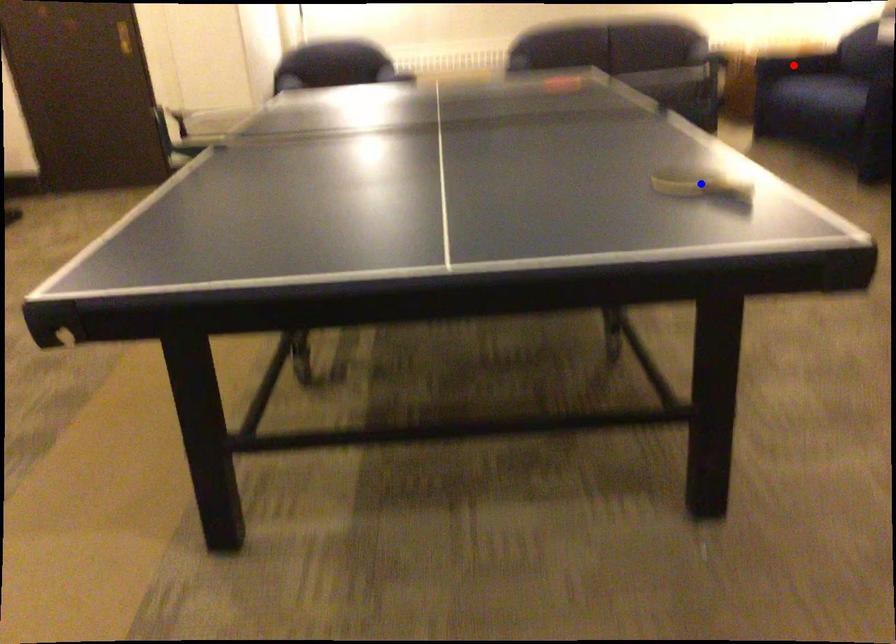
Question: Which of the two points in the image is closer to the camera?

Choices:
 (A) Blue point is closer.
 (B) Red point is closer.

Answer: (A)